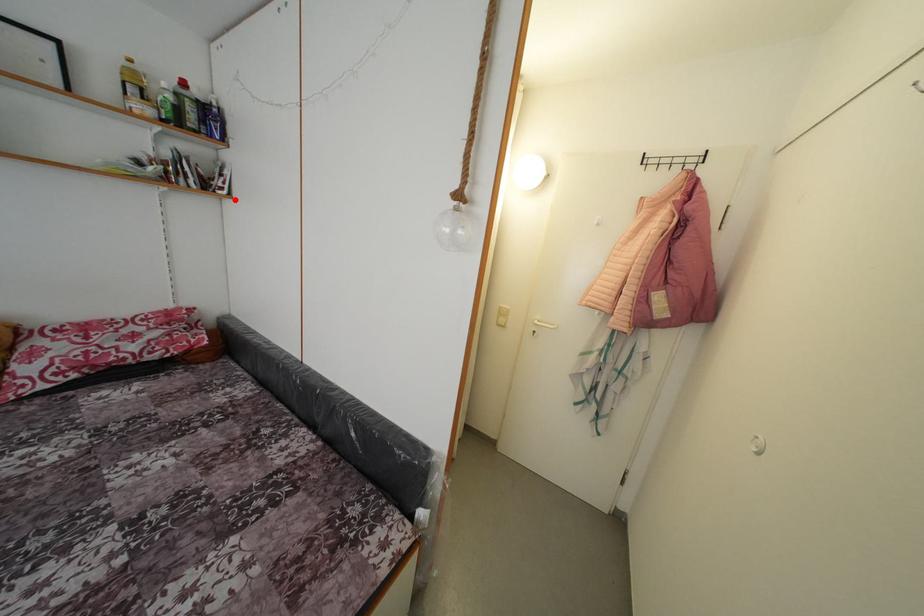
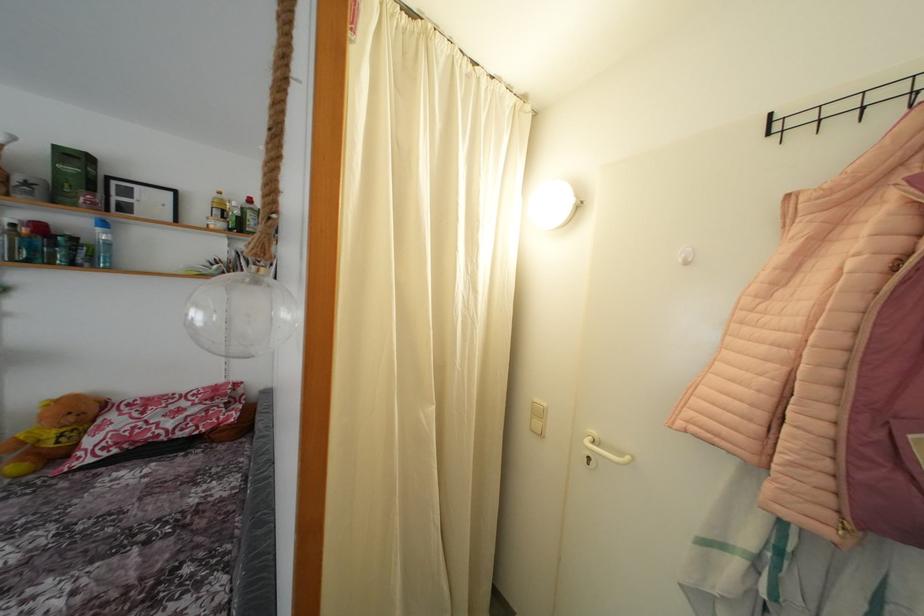
Where in the second image is the point corresponding to the highlighted location from the first image?

(281, 286)